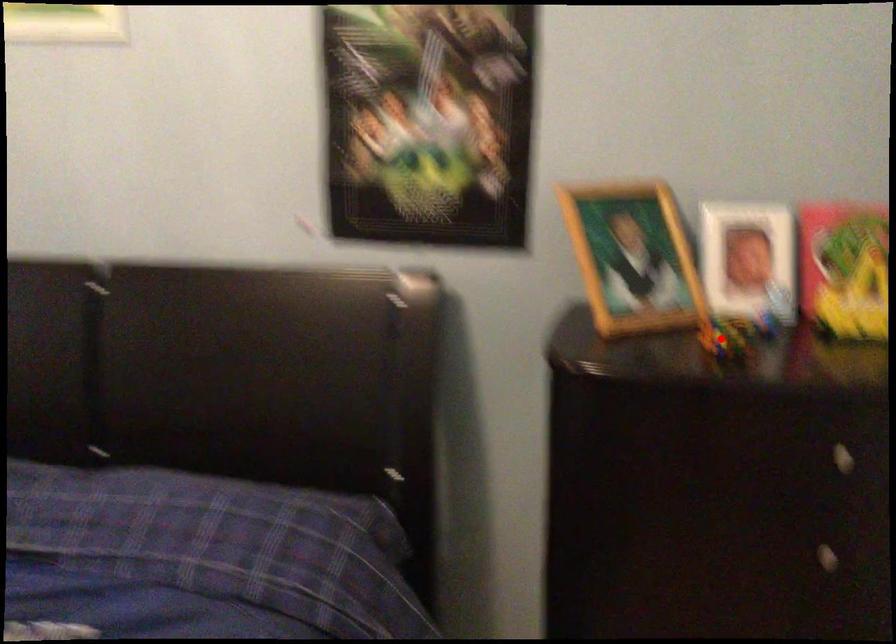
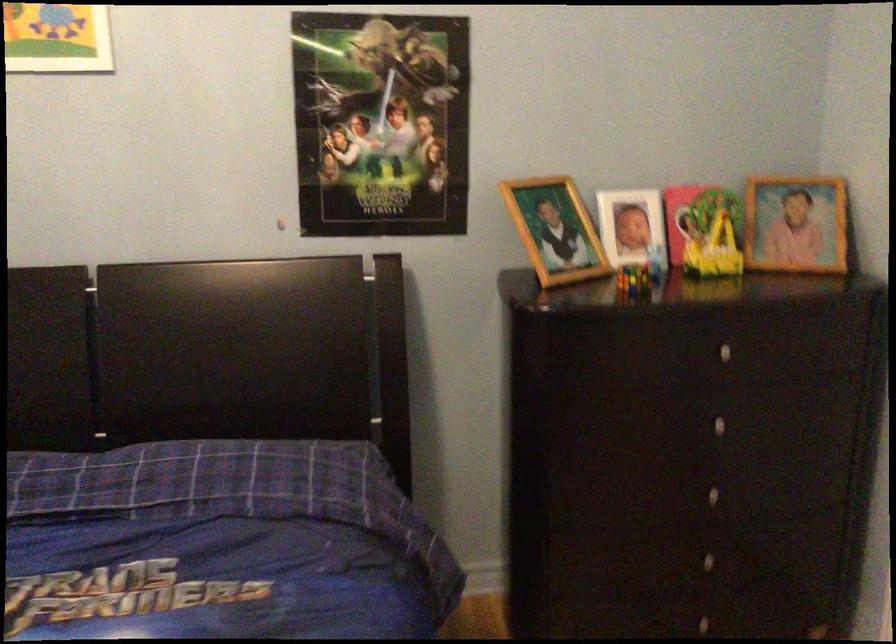
Find the pixel in the second image that matches the highlighted location in the first image.

(634, 279)